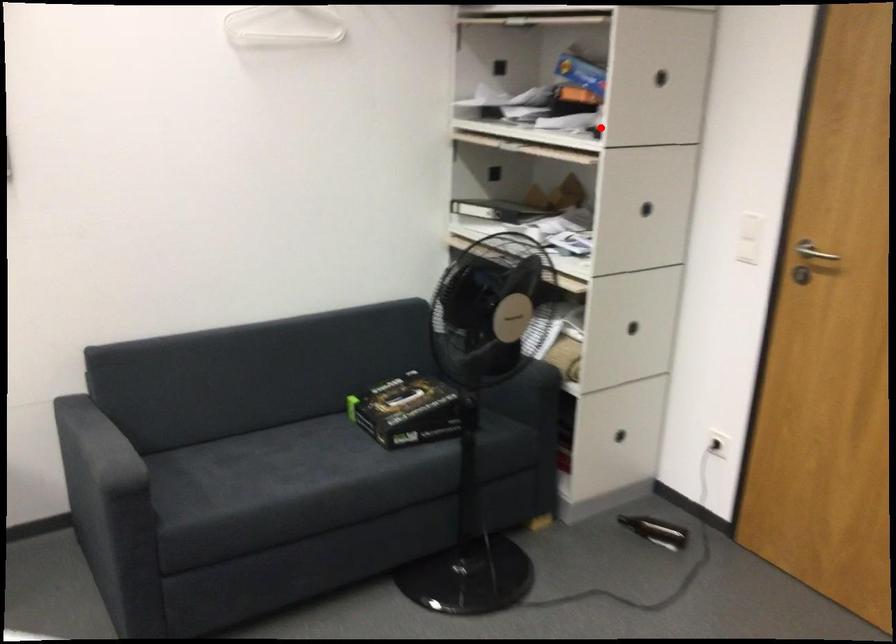
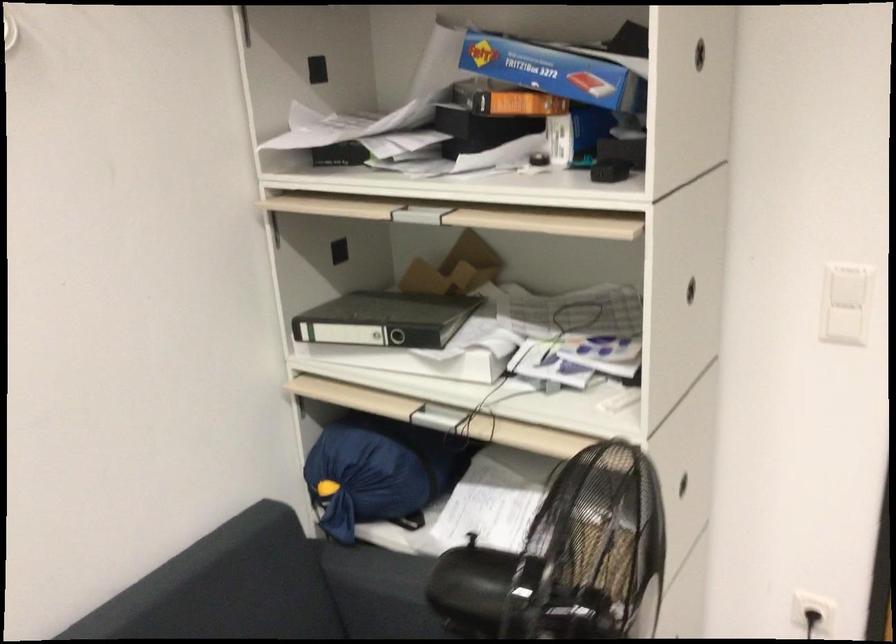
Locate, in the second image, the point that corresponds to the highlighted location in the first image.

(608, 171)